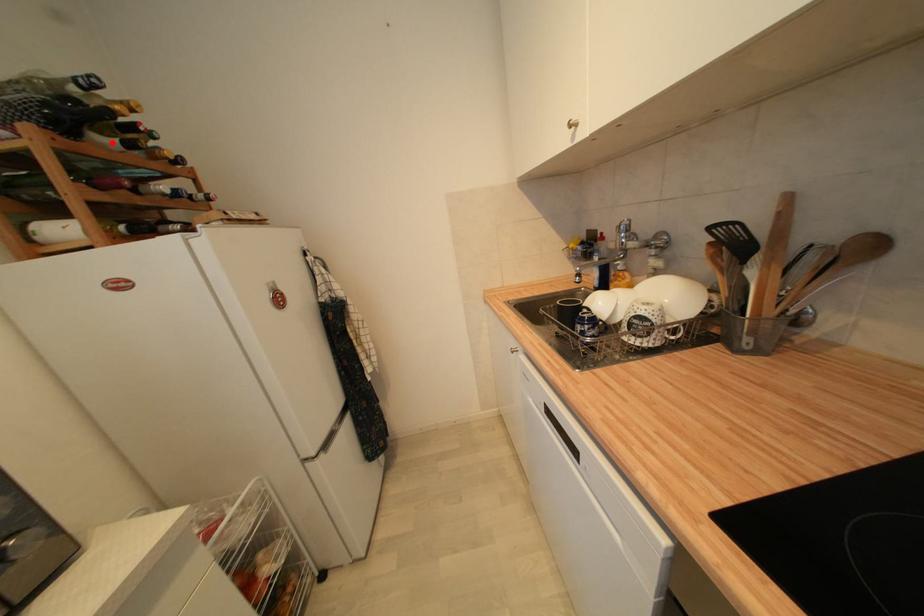
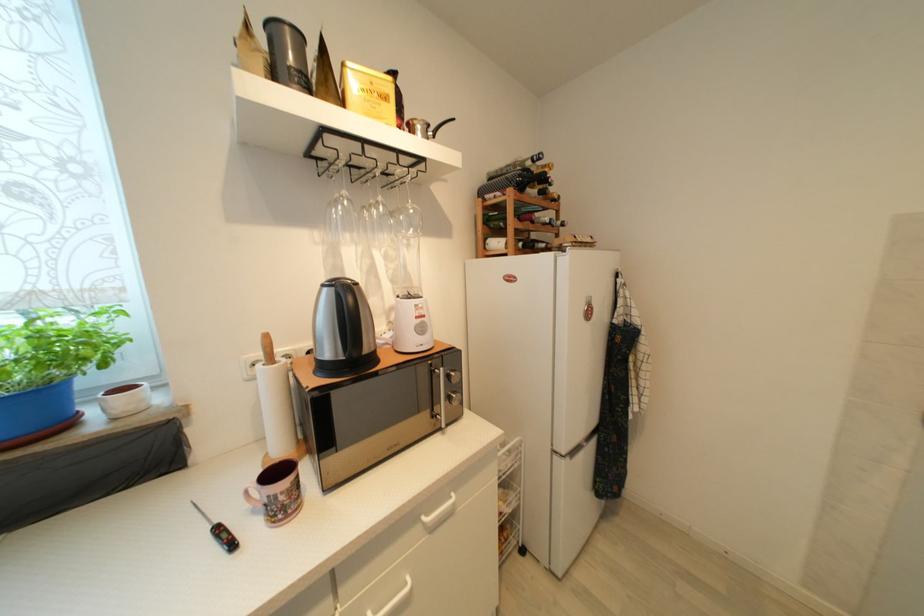
Question: I am providing you with two images of the same scene from different viewpoints. A red point is marked on the first image. Is the red point's position out of view in image 2?

Choices:
 (A) Yes
 (B) No

Answer: (B)